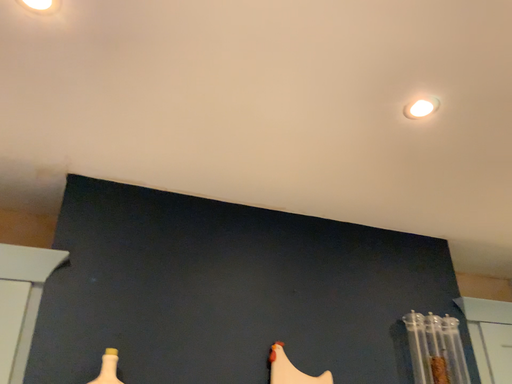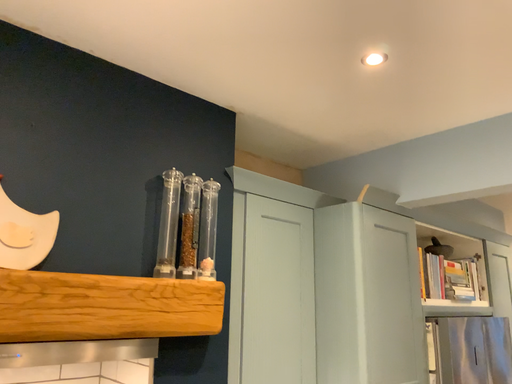
Question: Which way did the camera rotate in the video?

Choices:
 (A) rotated upward
 (B) rotated downward

Answer: (B)